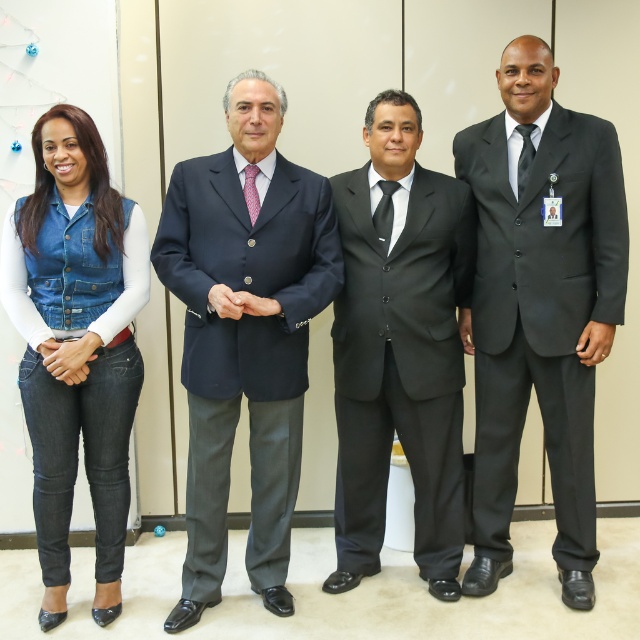
You are a photographer setting up for a group photo. You need to ensure there is at least 40 centimeters between the two subjects in the center to avoid overlapping in the frame. Based on the current positions of the navy blue suit at center and the black satin suit at center, is the distance sufficient?

The distance between the navy blue suit at center and the black satin suit at center is 38.41 centimeters, which is less than the required 40 centimeters. Therefore, the subjects are too close and need to move further apart to avoid overlapping in the frame.

You are a photographer arranging two suits for a photoshoot. The navy blue suit at center and the black satin suit at center need to be placed side by side. Which suit should you choose if you want the one that takes up more space?

The navy blue suit at center is bigger than the black satin suit at center, so you should choose the navy blue suit at center as it takes up more space.

In the image, there are two men wearing suits. One is in a dark blue suit with a red patterned tie, and the other is in a matte black suit represented by the point at coordinates [540,305]. Which of the two men is positioned further to the right?

The matte black suit at right is positioned further to the right as it is represented by the point at coordinates [540,305], which places it to the right of the dark blue suit with a red patterned tie.